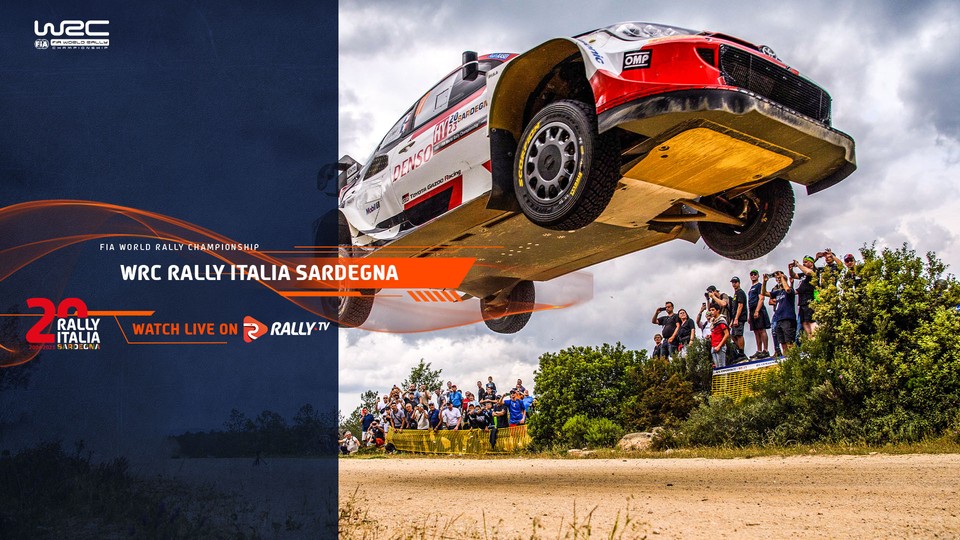
Find the location of `window`. window is located at coordinates (430, 96), (396, 128).